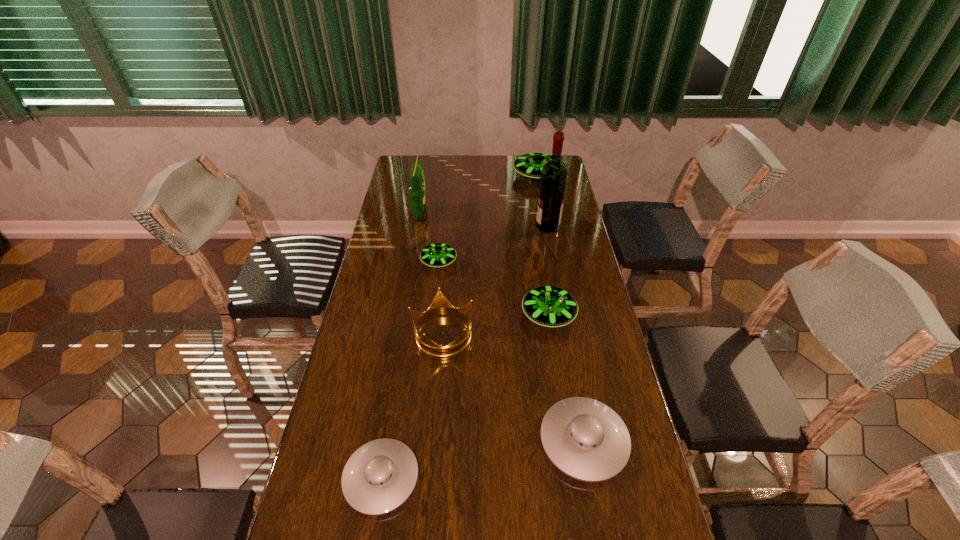
Where is `free point located 0.140m on the back of the right gray saucer`? free point located 0.140m on the back of the right gray saucer is located at coordinates (569, 361).

In order to click on vacant space situated on the right of the smallest green saucer in this screenshot , I will do pyautogui.click(x=562, y=262).

What are the coordinates of `free point located 0.260m on the back of the smaller gray saucer` in the screenshot? It's located at (400, 360).

Find the location of a particular element. This screenshot has width=960, height=540. object located at the far edge is located at coordinates (529, 165).

Find the location of `crisp (potato chip) at the left edge`. crisp (potato chip) at the left edge is located at coordinates (417, 190).

I want to click on saucer located in the left edge section of the desktop, so click(x=379, y=477).

Find the location of a particular element. This screenshot has height=540, width=960. alcohol present at the right edge is located at coordinates (553, 179).

Locate an element on the screen. This screenshot has height=540, width=960. object at the far right corner is located at coordinates (529, 165).

This screenshot has height=540, width=960. I want to click on free space at the far edge of the desktop, so click(x=512, y=157).

I want to click on free space at the left edge, so click(x=401, y=251).